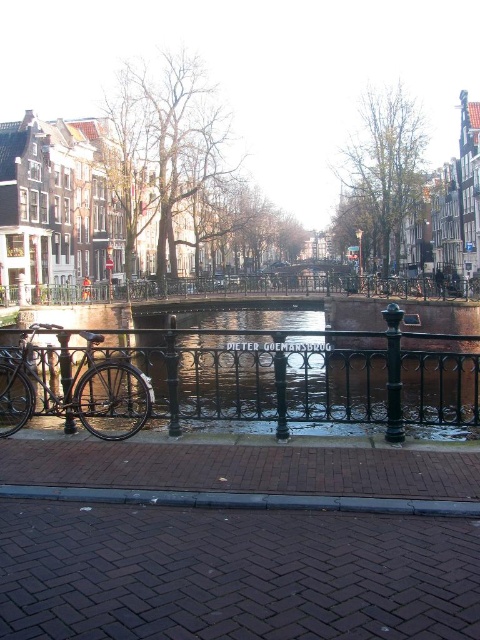
You are standing at the point with coordinates point (51, 292) and want to move towards point (14, 424). Based on the scene, which direction should you walk to reach your destination?

Point (14, 424) is in front of point (51, 292), so you should walk forward to reach it.

You are a tourist standing on the brick pavement at lower center and want to reach the shiny black bicycle at left. Which direction should you move to get closer to the bicycle?

To reach the shiny black bicycle at left from the brick pavement at lower center, you should move towards the left since the brick pavement is in front of the bicycle, meaning the bicycle is behind you relative to your current position on the pavement.